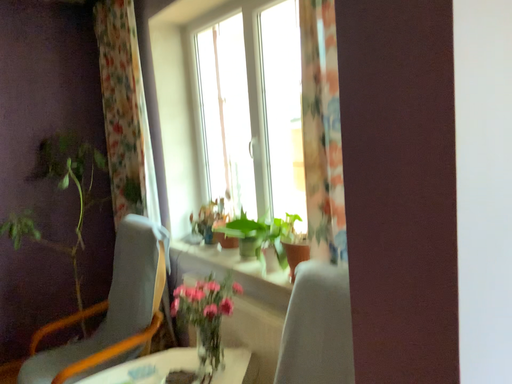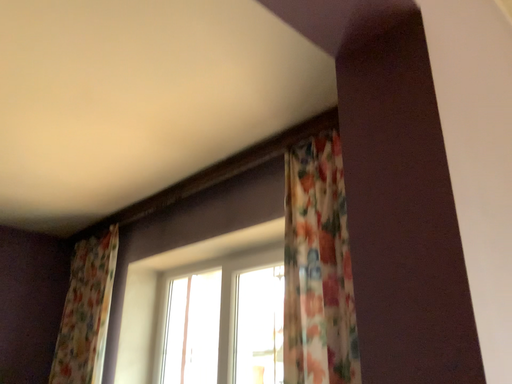
Question: Which way did the camera rotate in the video?

Choices:
 (A) rotated downward
 (B) rotated upward

Answer: (B)